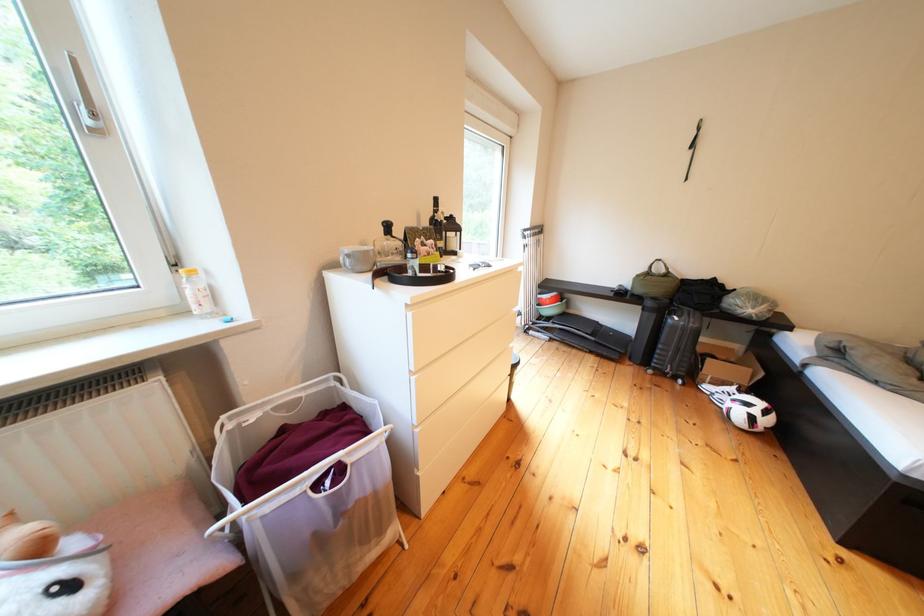
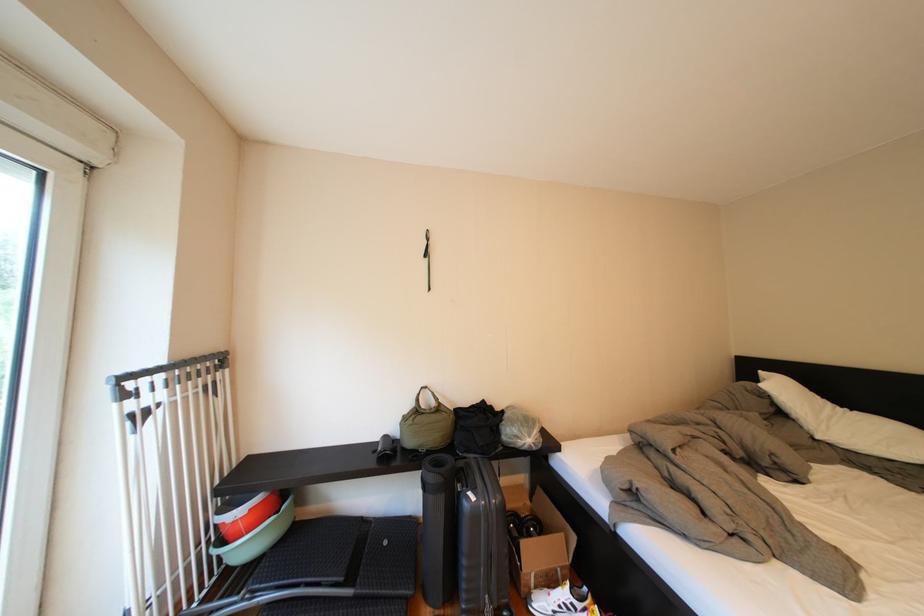
Find the pixel in the second image that matches [689,323] in the first image.

(487, 503)